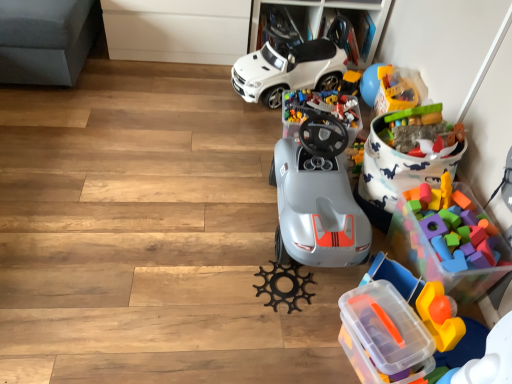
Find the location of a particular element. This screenshot has height=384, width=512. rubberized plastic toy at upper right, the 4th toy positioned from the bottom is located at coordinates (421, 132).

Measure the distance between point (449,348) and camera.

The distance of point (449,348) from camera is 1.29 meters.

Find the location of a particular element. This screenshot has height=384, width=512. gray plastic steering wheel at center, the 5th toy when ordered from bottom to top is located at coordinates (319, 110).

This screenshot has width=512, height=384. Describe the element at coordinates (383, 334) in the screenshot. I see `translucent plastic storage box at lower right` at that location.

You are a GUI agent. You are given a task and a screenshot of the screen. Output one action in this format:
    pyautogui.click(x=<x>, y=<y>)
    Task: Click on the rubberized plastic toy at upper right, the 4th toy positioned from the bottom
    
    Given the screenshot: What is the action you would take?
    pyautogui.click(x=421, y=132)

Is translucent plastic blocks at lower right, the 1th toy when ordered from bottom to top, in front of or behind rubberized plastic toy at upper right, the 4th toy positioned from the bottom, in the image?

Visually, translucent plastic blocks at lower right, the 1th toy when ordered from bottom to top, is located in front of rubberized plastic toy at upper right, the 4th toy positioned from the bottom.

How different are the orientations of translucent plastic blocks at lower right, the 1th toy when ordered from bottom to top, and rubberized plastic toy at upper right, marked as the 3th toy in a top-to-bottom arrangement, in degrees?

The angular difference between translucent plastic blocks at lower right, the 1th toy when ordered from bottom to top, and rubberized plastic toy at upper right, marked as the 3th toy in a top-to-bottom arrangement, is 9.75 degrees.

In terms of height, does translucent plastic blocks at lower right, the sixth toy positioned from the top, look taller or shorter compared to rubberized plastic toy at upper right, the 4th toy positioned from the bottom?

translucent plastic blocks at lower right, the sixth toy positioned from the top, is taller than rubberized plastic toy at upper right, the 4th toy positioned from the bottom.

Considering the relative sizes of translucent plastic blocks at lower right, the sixth toy positioned from the top, and rubberized plastic toy at upper right, marked as the 3th toy in a top-to-bottom arrangement, in the image provided, is translucent plastic blocks at lower right, the sixth toy positioned from the top, thinner than rubberized plastic toy at upper right, marked as the 3th toy in a top-to-bottom arrangement,?

Indeed, translucent plastic blocks at lower right, the sixth toy positioned from the top, has a lesser width compared to rubberized plastic toy at upper right, marked as the 3th toy in a top-to-bottom arrangement.

Does rubberized plastic toy at upper right, marked as the 3th toy in a top-to-bottom arrangement, touch gray plastic steering wheel at center, the 5th toy when ordered from bottom to top?

No, rubberized plastic toy at upper right, marked as the 3th toy in a top-to-bottom arrangement, is not touching gray plastic steering wheel at center, the 5th toy when ordered from bottom to top.

Find the location of a particular element. the 2nd toy counting from the left of the rubberized plastic toy at upper right, the 4th toy positioned from the bottom is located at coordinates (319, 110).

Looking at this image, considering the sizes of objects rubberized plastic toy at upper right, marked as the 3th toy in a top-to-bottom arrangement, and gray plastic steering wheel at center, positioned as the 2th toy in top-to-bottom order, in the image provided, who is smaller, rubberized plastic toy at upper right, marked as the 3th toy in a top-to-bottom arrangement, or gray plastic steering wheel at center, positioned as the 2th toy in top-to-bottom order,?

rubberized plastic toy at upper right, marked as the 3th toy in a top-to-bottom arrangement, is smaller.

Can you confirm if rubberized plastic toy at upper right, marked as the 3th toy in a top-to-bottom arrangement, is positioned to the left of gray plastic steering wheel at center, positioned as the 2th toy in top-to-bottom order?

Incorrect, rubberized plastic toy at upper right, marked as the 3th toy in a top-to-bottom arrangement, is not on the left side of gray plastic steering wheel at center, positioned as the 2th toy in top-to-bottom order.

Is translucent plastic storage box at lower right to the left of rubberized plastic toy at upper right, the 4th toy positioned from the bottom, from the viewer's perspective?

Yes.

Is point (378, 300) closer or farther from the camera than point (449, 138)?

Clearly, point (378, 300) is closer to the camera than point (449, 138).

Is rubberized plastic toy at upper right, the 4th toy positioned from the bottom, surrounded by translucent plastic storage box at lower right?

No, rubberized plastic toy at upper right, the 4th toy positioned from the bottom, is not surrounded by translucent plastic storage box at lower right.

From the image's perspective, does translucent plastic storage box at lower right appear higher than rubberized plastic toy at upper right, marked as the 3th toy in a top-to-bottom arrangement?

No, from the image's perspective, translucent plastic storage box at lower right is not over rubberized plastic toy at upper right, marked as the 3th toy in a top-to-bottom arrangement.

Can you confirm if translucent plastic blocks at lower right, the sixth toy positioned from the top, is wider than black matte gear at center, the 2th toy in the bottom-to-top sequence?

No.

Is point (395, 266) closer or farther from the camera than point (295, 262)?

Point (395, 266).

From a real-world perspective, is translucent plastic blocks at lower right, the sixth toy positioned from the top, below black matte gear at center, acting as the 5th toy starting from the top?

No, from a real-world perspective, translucent plastic blocks at lower right, the sixth toy positioned from the top, is not under black matte gear at center, acting as the 5th toy starting from the top.

Is black matte gear at center, acting as the 5th toy starting from the top, located within translucent plastic blocks at lower right, the sixth toy positioned from the top?

No, black matte gear at center, acting as the 5th toy starting from the top, is not a part of translucent plastic blocks at lower right, the sixth toy positioned from the top.

Is rubberized plastic toy at upper right, the 6th toy positioned from the bottom, not inside rubberized plastic toy at upper right, marked as the 3th toy in a top-to-bottom arrangement?

rubberized plastic toy at upper right, the 6th toy positioned from the bottom, lies outside rubberized plastic toy at upper right, marked as the 3th toy in a top-to-bottom arrangement,'s area.

Is rubberized plastic toy at upper right, positioned as the first toy in top-to-bottom order, positioned with its back to rubberized plastic toy at upper right, the 4th toy positioned from the bottom?

No, rubberized plastic toy at upper right, positioned as the first toy in top-to-bottom order, is not facing away from rubberized plastic toy at upper right, the 4th toy positioned from the bottom.

Which of these two, rubberized plastic toy at upper right, positioned as the first toy in top-to-bottom order, or rubberized plastic toy at upper right, the 4th toy positioned from the bottom, is wider?

rubberized plastic toy at upper right, the 4th toy positioned from the bottom.

Is rubberized plastic toy at upper right, positioned as the first toy in top-to-bottom order, with rubberized plastic toy at upper right, the 4th toy positioned from the bottom?

They are not placed beside each other.

Are gray plastic steering wheel at center, the 5th toy when ordered from bottom to top, and translucent plastic storage box at lower right making contact?

gray plastic steering wheel at center, the 5th toy when ordered from bottom to top, and translucent plastic storage box at lower right are not in contact.

Between gray plastic steering wheel at center, positioned as the 2th toy in top-to-bottom order, and translucent plastic storage box at lower right, which one has larger size?

Bigger between the two is gray plastic steering wheel at center, positioned as the 2th toy in top-to-bottom order.

Is point (301, 112) closer or farther from the camera than point (395, 303)?

Clearly, point (301, 112) is more distant from the camera than point (395, 303).

Which is farther from the camera, [434,303] or [467,209]?

Positioned behind is point [467,209].

From the picture: Can you confirm if translucent plastic blocks at lower right, the 1th toy when ordered from bottom to top, is thinner than multicolored foam blocks at right, the fourth toy when ordered from top to bottom?

Correct, the width of translucent plastic blocks at lower right, the 1th toy when ordered from bottom to top, is less than that of multicolored foam blocks at right, the fourth toy when ordered from top to bottom.

Measure the distance from translucent plastic blocks at lower right, the 1th toy when ordered from bottom to top, to multicolored foam blocks at right, which is counted as the third toy, starting from the bottom.

translucent plastic blocks at lower right, the 1th toy when ordered from bottom to top, is 8.35 inches from multicolored foam blocks at right, which is counted as the third toy, starting from the bottom.

Is translucent plastic blocks at lower right, the sixth toy positioned from the top, to the right of multicolored foam blocks at right, the fourth toy when ordered from top to bottom, from the viewer's perspective?

In fact, translucent plastic blocks at lower right, the sixth toy positioned from the top, is to the left of multicolored foam blocks at right, the fourth toy when ordered from top to bottom.

There is a translucent plastic blocks at lower right, the sixth toy positioned from the top. Where is `the 3rd toy above it (from the image's perspective)`? Image resolution: width=512 pixels, height=384 pixels. the 3rd toy above it (from the image's perspective) is located at coordinates (421, 132).

From a real-world perspective, which toy is the 4th one above the gray plastic steering wheel at center, positioned as the 2th toy in top-to-bottom order? Please provide its 2D coordinates.

[(421, 132)]

Looking at the image, which one is located closer to black matte gear at center, acting as the 5th toy starting from the top, rubberized plastic toy at upper right, marked as the 3th toy in a top-to-bottom arrangement, or translucent plastic blocks at lower right, the 1th toy when ordered from bottom to top?

Based on the image, translucent plastic blocks at lower right, the 1th toy when ordered from bottom to top, appears to be nearer to black matte gear at center, acting as the 5th toy starting from the top.

Estimate the real-world distances between objects in this image. Which object is further from translucent plastic storage box at lower right, rubberized plastic toy at upper right, marked as the 3th toy in a top-to-bottom arrangement, or white matte toy car at center?

Among the two, white matte toy car at center is located further to translucent plastic storage box at lower right.

Estimate the real-world distances between objects in this image. Which object is closer to white matte toy car at center, gray plastic steering wheel at center, positioned as the 2th toy in top-to-bottom order, or rubberized plastic toy at upper right, marked as the 3th toy in a top-to-bottom arrangement?

The object closer to white matte toy car at center is gray plastic steering wheel at center, positioned as the 2th toy in top-to-bottom order.

From the picture: Which object lies further to the anchor point translucent plastic storage box at lower right, black matte gear at center, the 2th toy in the bottom-to-top sequence, or white matte toy car at center?

white matte toy car at center lies further to translucent plastic storage box at lower right than the other object.

Considering their positions, is rubberized plastic toy at upper right, the 6th toy positioned from the bottom, positioned closer to gray plastic steering wheel at center, positioned as the 2th toy in top-to-bottom order, than rubberized plastic toy at upper right, marked as the 3th toy in a top-to-bottom arrangement?

rubberized plastic toy at upper right, the 6th toy positioned from the bottom, is closer to gray plastic steering wheel at center, positioned as the 2th toy in top-to-bottom order.

When comparing their distances from black matte gear at center, acting as the 5th toy starting from the top, does gray plastic steering wheel at center, positioned as the 2th toy in top-to-bottom order, or white matte toy car at center seem further?

Based on the image, white matte toy car at center appears to be further to black matte gear at center, acting as the 5th toy starting from the top.

Based on the photo, looking at the image, which one is located closer to translucent plastic blocks at lower right, the sixth toy positioned from the top, white matte toy car at center or multicolored foam blocks at right, which is counted as the third toy, starting from the bottom?

Based on the image, multicolored foam blocks at right, which is counted as the third toy, starting from the bottom, appears to be nearer to translucent plastic blocks at lower right, the sixth toy positioned from the top.

Which object lies further to the anchor point translucent plastic blocks at lower right, the sixth toy positioned from the top, white matte toy car at center or rubberized plastic toy at upper right, the 6th toy positioned from the bottom?

white matte toy car at center is positioned further to the anchor translucent plastic blocks at lower right, the sixth toy positioned from the top.

Where is `toy between rubberized plastic toy at upper right, the 4th toy positioned from the bottom, and white matte toy car at center, along the z-axis`? This screenshot has width=512, height=384. toy between rubberized plastic toy at upper right, the 4th toy positioned from the bottom, and white matte toy car at center, along the z-axis is located at coordinates pos(319,110).

Identify the location of toy between rubberized plastic toy at upper right, marked as the 3th toy in a top-to-bottom arrangement, and black matte gear at center, acting as the 5th toy starting from the top, in the up-down direction. (454, 227).

Identify the location of toy between rubberized plastic toy at upper right, the 4th toy positioned from the bottom, and rubberized plastic toy at upper right, the 6th toy positioned from the bottom, along the z-axis. (319, 110).

What are the coordinates of `storage box between black matte gear at center, acting as the 5th toy starting from the top, and translucent plastic blocks at lower right, the 1th toy when ordered from bottom to top` in the screenshot? It's located at (383, 334).